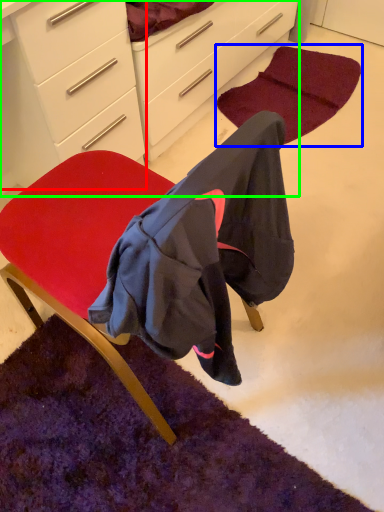
Question: Which is farther away from chest of drawers (highlighted by a red box)? mat (highlighted by a blue box) or cabinetry (highlighted by a green box)?

Choices:
 (A) mat
 (B) cabinetry

Answer: (A)